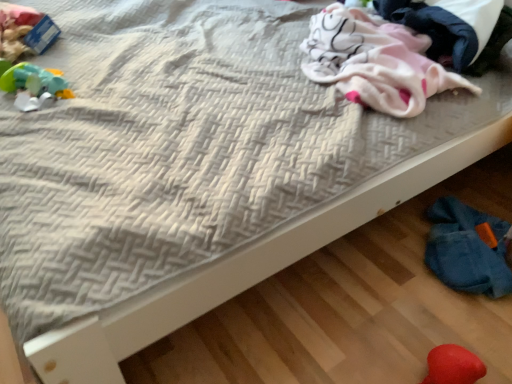
What do you see at coordinates (34, 85) in the screenshot? The image size is (512, 384). I see `rubberized green toy at left, acting as the 2th toy starting from the front` at bounding box center [34, 85].

In order to click on rubberized green toy at left, which is the first toy in left-to-right order in this screenshot , I will do `click(34, 85)`.

The height and width of the screenshot is (384, 512). I want to click on pink soft fabric at upper right, so click(434, 30).

In the scene shown: Measure the distance between fuzzy red heart at lower right, the 1th toy when ordered from front to back, and camera.

34.99 inches.

Where is `pink fleece blanket at upper right`? pink fleece blanket at upper right is located at coordinates (375, 62).

Relative to rubberized green toy at left, acting as the 2th toy starting from the front, is pink fleece blanket at upper right in front or behind?

Clearly, pink fleece blanket at upper right is in front of rubberized green toy at left, acting as the 2th toy starting from the front.

Who is taller, pink fleece blanket at upper right or rubberized green toy at left, which is the first toy in left-to-right order?

With more height is pink fleece blanket at upper right.

Considering the positions of objects pink fleece blanket at upper right and rubberized green toy at left, which is the first toy from back to front, in the image provided, who is more to the right, pink fleece blanket at upper right or rubberized green toy at left, which is the first toy from back to front,?

From the viewer's perspective, pink fleece blanket at upper right appears more on the right side.

Is pink fleece blanket at upper right directly adjacent to rubberized green toy at left, the first toy positioned from the top?

No, pink fleece blanket at upper right is not in contact with rubberized green toy at left, the first toy positioned from the top.

Can you confirm if pink soft fabric at upper right is thinner than pink fleece blanket at upper right?

Yes.

I want to click on clothing positioned vertically above the pink fleece blanket at upper right (from a real-world perspective), so click(x=434, y=30).

Between pink soft fabric at upper right and pink fleece blanket at upper right, which one appears on the right side from the viewer's perspective?

pink soft fabric at upper right is more to the right.

Considering the positions of objects pink fleece blanket at upper right and pink soft fabric at upper right in the image provided, who is behind, pink fleece blanket at upper right or pink soft fabric at upper right?

pink soft fabric at upper right is behind.

Is pink fleece blanket at upper right not within pink soft fabric at upper right?

Yes, pink fleece blanket at upper right is outside of pink soft fabric at upper right.

The height and width of the screenshot is (384, 512). Identify the location of material below the pink soft fabric at upper right (from a real-world perspective). pos(375,62).

Who is smaller, pink fleece blanket at upper right or pink soft fabric at upper right?

pink soft fabric at upper right is smaller.

I want to click on toy that appears on the left of fuzzy red heart at lower right, the second toy when ordered from left to right, so click(34, 85).

Measure the distance between fuzzy red heart at lower right, the 1th toy in the right-to-left sequence, and rubberized green toy at left, the first toy positioned from the top.

They are 1.28 meters apart.

From the picture: Who is shorter, fuzzy red heart at lower right, the second toy when ordered from left to right, or rubberized green toy at left, which is the first toy in left-to-right order?

With less height is rubberized green toy at left, which is the first toy in left-to-right order.

Considering the relative sizes of fuzzy red heart at lower right, the 1th toy positioned from the bottom, and rubberized green toy at left, acting as the 2th toy starting from the front, in the image provided, is fuzzy red heart at lower right, the 1th toy positioned from the bottom, bigger than rubberized green toy at left, acting as the 2th toy starting from the front,?

No.

In terms of size, does fuzzy red heart at lower right, the 1th toy positioned from the bottom, appear bigger or smaller than pink soft fabric at upper right?

fuzzy red heart at lower right, the 1th toy positioned from the bottom, is smaller than pink soft fabric at upper right.

In terms of width, does fuzzy red heart at lower right, the second toy when ordered from left to right, look wider or thinner when compared to pink soft fabric at upper right?

Considering their sizes, fuzzy red heart at lower right, the second toy when ordered from left to right, looks slimmer than pink soft fabric at upper right.

From a real-world perspective, is fuzzy red heart at lower right, the 1th toy when ordered from front to back, on pink soft fabric at upper right?

Incorrect, from a real-world perspective, fuzzy red heart at lower right, the 1th toy when ordered from front to back, is lower than pink soft fabric at upper right.

Is pink soft fabric at upper right far away from rubberized green toy at left, the 2th toy when ordered from bottom to top?

Yes, pink soft fabric at upper right and rubberized green toy at left, the 2th toy when ordered from bottom to top, are quite far apart.

Is pink soft fabric at upper right inside the boundaries of rubberized green toy at left, the first toy positioned from the top, or outside?

pink soft fabric at upper right is spatially situated outside rubberized green toy at left, the first toy positioned from the top.

Is pink soft fabric at upper right closer to the viewer compared to rubberized green toy at left, which is the first toy from back to front?

Yes, it is.

From the image's perspective, would you say fuzzy red heart at lower right, the 1th toy when ordered from front to back, is positioned over pink fleece blanket at upper right?

Incorrect, from the image's perspective, fuzzy red heart at lower right, the 1th toy when ordered from front to back, is lower than pink fleece blanket at upper right.

Could you tell me if fuzzy red heart at lower right, the second toy when ordered from left to right, is facing pink fleece blanket at upper right?

No, fuzzy red heart at lower right, the second toy when ordered from left to right, is not oriented towards pink fleece blanket at upper right.

Is pink fleece blanket at upper right completely or partially inside fuzzy red heart at lower right, which ranks as the 2th toy in top-to-bottom order?

No.

Does fuzzy red heart at lower right, which is the second toy in back-to-front order, have a greater height compared to pink fleece blanket at upper right?

Incorrect, the height of fuzzy red heart at lower right, which is the second toy in back-to-front order, is not larger of that of pink fleece blanket at upper right.

This screenshot has width=512, height=384. I want to click on toy on the left of the pink fleece blanket at upper right, so click(x=34, y=85).

Image resolution: width=512 pixels, height=384 pixels. I want to click on clothing above the pink fleece blanket at upper right (from a real-world perspective), so click(434, 30).

Looking at the image, which one is located further to fuzzy red heart at lower right, the 1th toy in the right-to-left sequence, pink soft fabric at upper right or pink fleece blanket at upper right?

pink soft fabric at upper right lies further to fuzzy red heart at lower right, the 1th toy in the right-to-left sequence, than the other object.

From the image, which object appears to be nearer to pink soft fabric at upper right, fuzzy red heart at lower right, the second toy when ordered from left to right, or rubberized green toy at left, the 2th toy when ordered from bottom to top?

Based on the image, fuzzy red heart at lower right, the second toy when ordered from left to right, appears to be nearer to pink soft fabric at upper right.

When comparing their distances from pink soft fabric at upper right, does pink fleece blanket at upper right or fuzzy red heart at lower right, the second toy when ordered from left to right, seem closer?

Based on the image, pink fleece blanket at upper right appears to be nearer to pink soft fabric at upper right.

Estimate the real-world distances between objects in this image. Which object is further from pink soft fabric at upper right, pink fleece blanket at upper right or rubberized green toy at left, the first toy positioned from the top?

The object further to pink soft fabric at upper right is rubberized green toy at left, the first toy positioned from the top.

Estimate the real-world distances between objects in this image. Which object is further from pink fleece blanket at upper right, rubberized green toy at left, which is the first toy in left-to-right order, or fuzzy red heart at lower right, the 1th toy positioned from the bottom?

Based on the image, rubberized green toy at left, which is the first toy in left-to-right order, appears to be further to pink fleece blanket at upper right.

From the image, which object appears to be nearer to fuzzy red heart at lower right, which is the second toy in back-to-front order, rubberized green toy at left, the 2th toy when ordered from bottom to top, or pink soft fabric at upper right?

pink soft fabric at upper right lies closer to fuzzy red heart at lower right, which is the second toy in back-to-front order, than the other object.

Looking at the image, which one is located closer to rubberized green toy at left, the 2th toy when ordered from bottom to top, fuzzy red heart at lower right, the 1th toy positioned from the bottom, or pink soft fabric at upper right?

pink soft fabric at upper right is closer to rubberized green toy at left, the 2th toy when ordered from bottom to top.

Based on their spatial positions, is fuzzy red heart at lower right, the 1th toy when ordered from front to back, or pink fleece blanket at upper right further from pink soft fabric at upper right?

fuzzy red heart at lower right, the 1th toy when ordered from front to back, lies further to pink soft fabric at upper right than the other object.

Where is `toy between rubberized green toy at left, which is the first toy in left-to-right order, and pink soft fabric at upper right, in the horizontal direction`? The image size is (512, 384). toy between rubberized green toy at left, which is the first toy in left-to-right order, and pink soft fabric at upper right, in the horizontal direction is located at coordinates (453, 366).

The image size is (512, 384). I want to click on material between pink soft fabric at upper right and fuzzy red heart at lower right, the 1th toy positioned from the bottom, vertically, so point(375,62).

Where is `material situated between rubberized green toy at left, the 2th toy from the right, and fuzzy red heart at lower right, which ranks as the 2th toy in top-to-bottom order, from left to right`? This screenshot has width=512, height=384. material situated between rubberized green toy at left, the 2th toy from the right, and fuzzy red heart at lower right, which ranks as the 2th toy in top-to-bottom order, from left to right is located at coordinates (375, 62).

Locate an element on the screen. The image size is (512, 384). material located between rubberized green toy at left, acting as the 2th toy starting from the front, and pink soft fabric at upper right in the left-right direction is located at coordinates (375, 62).